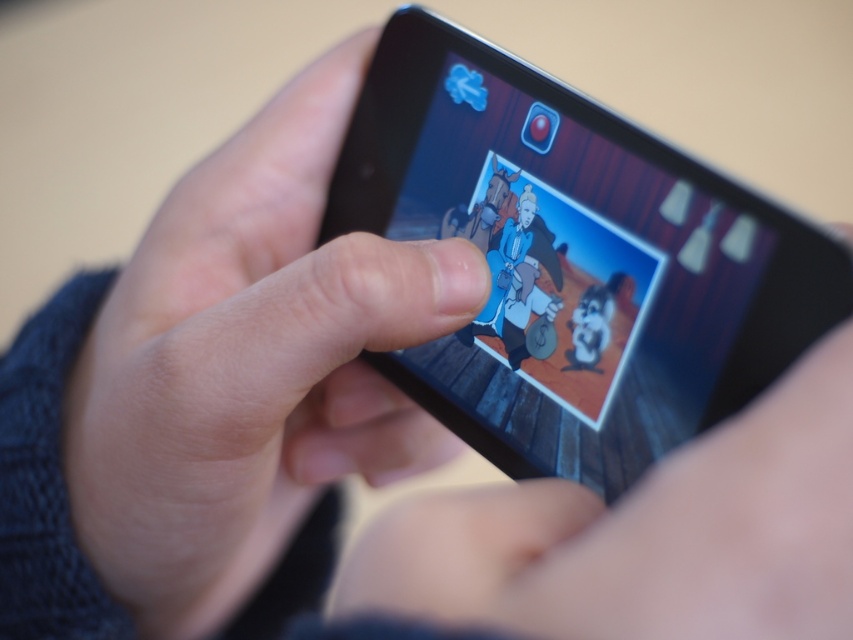
You are trying to take a photo of your hand holding the smartphone. Since the smooth skin hand at center is taller than the black matte smartphone at center, will the smartphone fit entirely within the frame if you position it so that the bottom edge of the smartphone aligns with the bottom of your hand?

The smooth skin hand at center is taller than the black matte smartphone at center, so if you align the bottom edge of the smartphone with the bottom of your hand, the smartphone will fit entirely within the frame because the hand is taller and can accommodate the smartphone vertically.